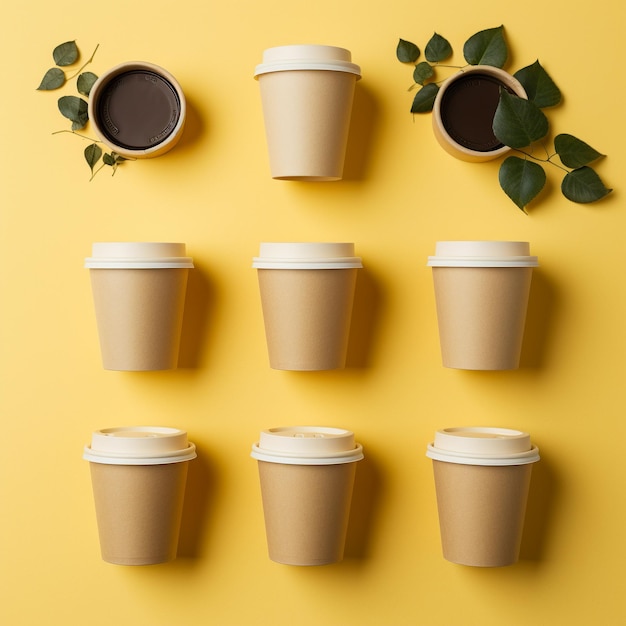
Image resolution: width=626 pixels, height=626 pixels. What are the coordinates of `coffee cup` in the screenshot? It's located at (491, 498), (302, 491), (140, 500), (144, 321), (325, 314), (483, 290), (467, 116), (325, 91), (130, 104).